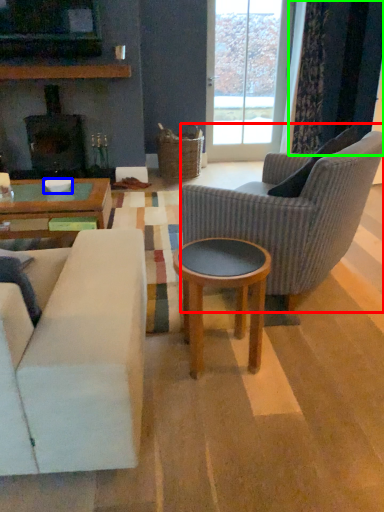
Question: Which is farther away from chair (highlighted by a red box)? bowl (highlighted by a blue box) or curtain (highlighted by a green box)?

Choices:
 (A) bowl
 (B) curtain

Answer: (B)